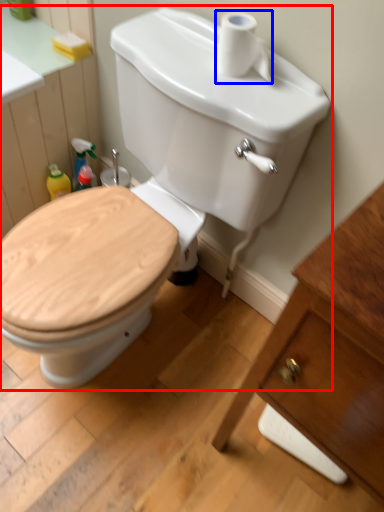
Question: Which object is closer to the camera taking this photo, toilet (highlighted by a red box) or toilet paper (highlighted by a blue box)?

Choices:
 (A) toilet
 (B) toilet paper

Answer: (A)